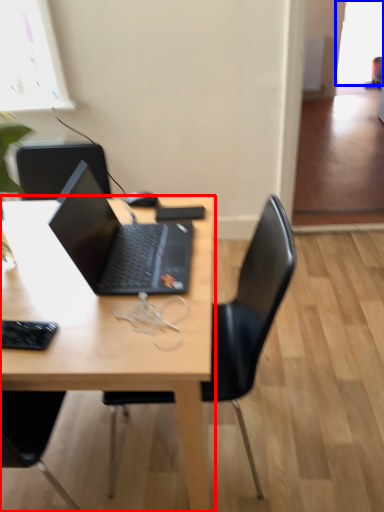
Question: Among these objects, which one is farthest to the camera, desk (highlighted by a red box) or window screen (highlighted by a blue box)?

Choices:
 (A) desk
 (B) window screen

Answer: (B)